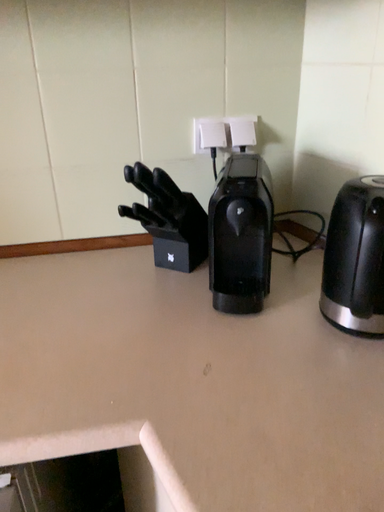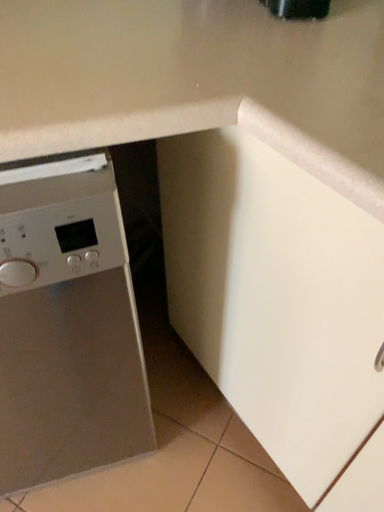
Question: Which way did the camera rotate in the video?

Choices:
 (A) rotated left
 (B) rotated right

Answer: (B)